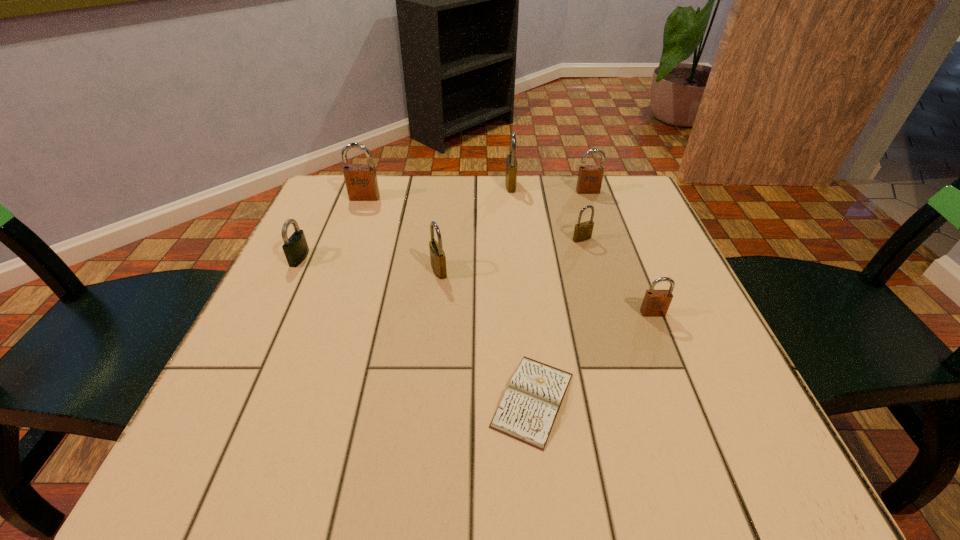
Image resolution: width=960 pixels, height=540 pixels. In order to click on the fifth nearest object in this screenshot , I will do `click(583, 231)`.

Where is `the nearest brown padlock`? The height and width of the screenshot is (540, 960). the nearest brown padlock is located at coordinates (656, 303).

Image resolution: width=960 pixels, height=540 pixels. I want to click on the smallest brown padlock, so click(656, 303).

Find the location of a particular element. Image resolution: width=960 pixels, height=540 pixels. diary is located at coordinates (528, 409).

You are a GUI agent. You are given a task and a screenshot of the screen. Output one action in this format:
    pyautogui.click(x=<x>, y=<y>)
    Task: Click on the shortest object
    
    Given the screenshot: What is the action you would take?
    pyautogui.click(x=528, y=409)

Where is `blank space located on the left of the farthest brass padlock`? Image resolution: width=960 pixels, height=540 pixels. blank space located on the left of the farthest brass padlock is located at coordinates (453, 186).

Identify the location of vacant area situated 0.230m on the front-facing side of the seventh object from right to left. (x=343, y=259).

What are the coordinates of `free region located 0.250m on the front-facing side of the farthest brown padlock` in the screenshot? It's located at click(x=610, y=255).

Identify the location of vacant space located 0.220m on the front of the leftmost brass padlock. This screenshot has width=960, height=540. (428, 368).

Image resolution: width=960 pixels, height=540 pixels. In order to click on vacant region located 0.190m on the right of the leftmost padlock in this screenshot , I will do `click(395, 258)`.